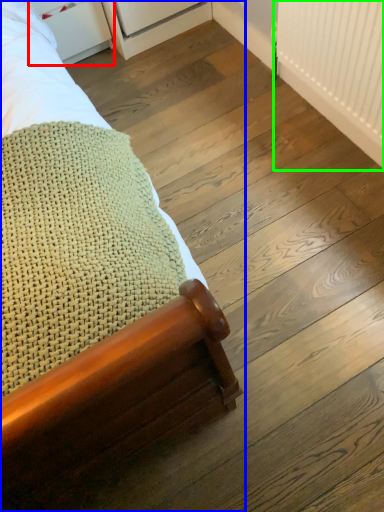
Question: Which is nearer to the drawer (highlighted by a red box)? bed (highlighted by a blue box) or radiator (highlighted by a green box).

Choices:
 (A) bed
 (B) radiator

Answer: (A)